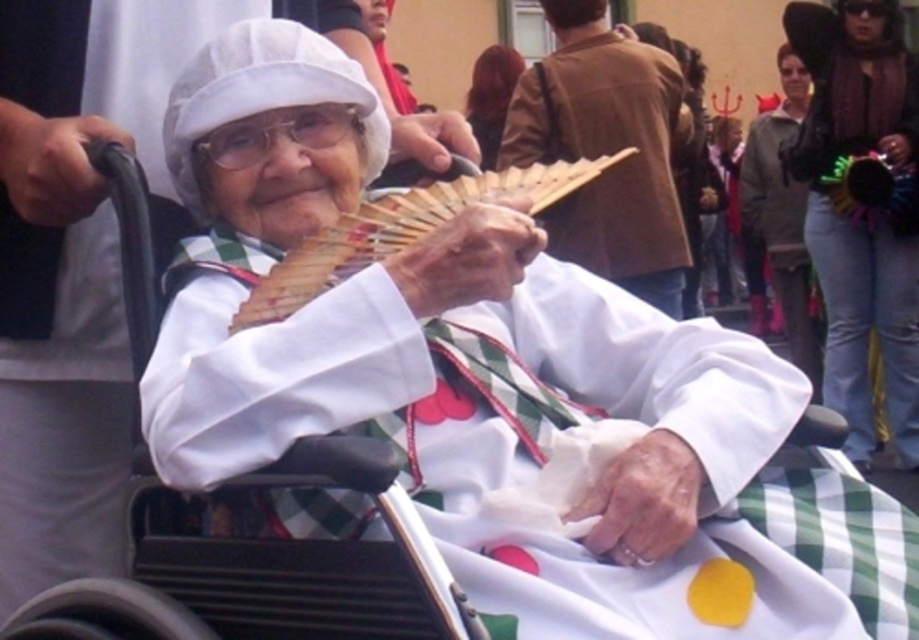
Looking at this image, which is more to the right, wooden fan at center or matte brown leather jacket at upper center?

Positioned to the right is matte brown leather jacket at upper center.

Can you confirm if wooden fan at center is thinner than matte brown leather jacket at upper center?

Yes, wooden fan at center is thinner than matte brown leather jacket at upper center.

At what (x,y) coordinates should I click in order to perform the action: click on wooden fan at center. Please return your answer as a coordinate pair (x, y). Looking at the image, I should click on (400, 230).

Where is `wooden fan at center`? wooden fan at center is located at coordinates (400, 230).